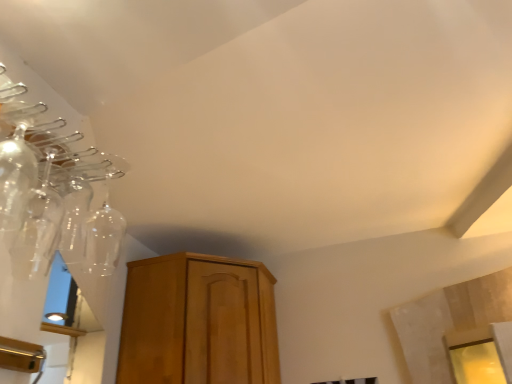
Question: From a real-world perspective, is transparent glass bottle at left, marked as the second glass bottle in a back-to-front arrangement, physically located above or below transparent glass bottle at upper left, which is the 2th glass bottle in front-to-back order?

Choices:
 (A) below
 (B) above

Answer: (A)

Question: Based on their sizes in the image, would you say transparent glass bottle at left, marked as the second glass bottle in a back-to-front arrangement, is bigger or smaller than transparent glass bottle at upper left, which is the 2th glass bottle in front-to-back order?

Choices:
 (A) small
 (B) big

Answer: (A)

Question: Is point tap(34, 162) closer or farther from the camera than point tap(39, 218)?

Choices:
 (A) farther
 (B) closer

Answer: (B)

Question: Considering their positions, is transparent glass bottle at upper left, which is the 2th glass bottle in front-to-back order, located in front of or behind transparent glass bottle at left, marked as the second glass bottle in a back-to-front arrangement?

Choices:
 (A) front
 (B) behind

Answer: (B)

Question: Looking at their shapes, would you say transparent glass bottle at upper left, the 1th glass bottle when ordered from back to front, is wider or thinner than transparent glass bottle at left, acting as the 1th glass bottle starting from the front?

Choices:
 (A) wide
 (B) thin

Answer: (A)

Question: Would you say transparent glass bottle at upper left, the 1th glass bottle when ordered from back to front, is inside or outside transparent glass bottle at left, marked as the second glass bottle in a back-to-front arrangement?

Choices:
 (A) outside
 (B) inside

Answer: (A)

Question: Is transparent glass bottle at upper left, which is the 2th glass bottle in front-to-back order, bigger or smaller than transparent glass bottle at left, marked as the second glass bottle in a back-to-front arrangement?

Choices:
 (A) small
 (B) big

Answer: (B)